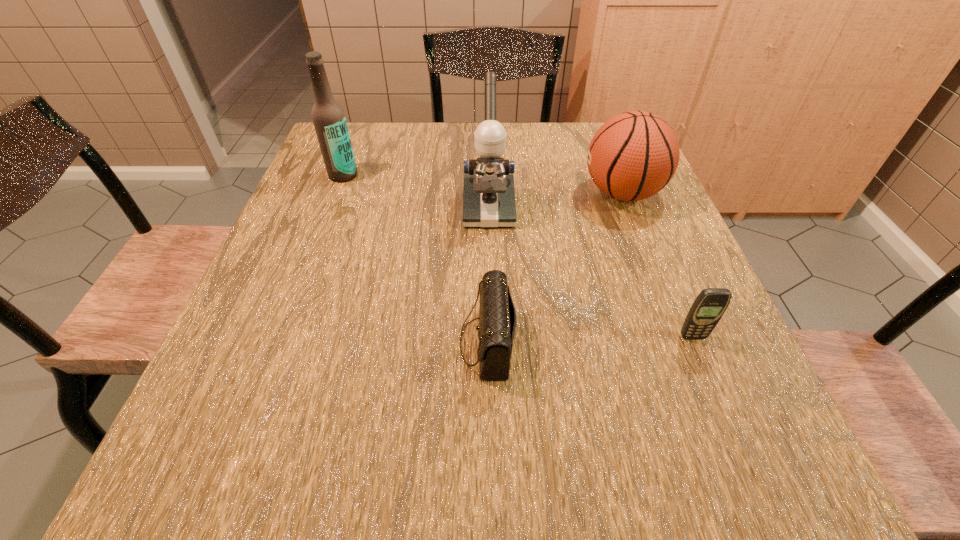
Locate an element on the screen. The width and height of the screenshot is (960, 540). vacant space positioned 0.060m on the screen of the cellular telephone is located at coordinates (706, 370).

Where is `vacant space positioned 0.160m on the front flap of the shortest object`? Image resolution: width=960 pixels, height=540 pixels. vacant space positioned 0.160m on the front flap of the shortest object is located at coordinates (368, 342).

Where is `vacant point located on the front flap of the shortest object`? The height and width of the screenshot is (540, 960). vacant point located on the front flap of the shortest object is located at coordinates (275, 342).

The image size is (960, 540). I want to click on blank space located on the front flap of the shortest object, so click(385, 342).

This screenshot has width=960, height=540. Find the location of `object present at the far edge`. object present at the far edge is located at coordinates (329, 120).

The width and height of the screenshot is (960, 540). I want to click on object that is positioned at the left edge, so click(329, 120).

The height and width of the screenshot is (540, 960). What are the coordinates of `basketball that is at the right edge` in the screenshot? It's located at tap(634, 155).

This screenshot has width=960, height=540. What are the coordinates of `cellular telephone that is at the right edge` in the screenshot? It's located at (709, 306).

Where is `object that is positioned at the far left corner`? The height and width of the screenshot is (540, 960). object that is positioned at the far left corner is located at coordinates (329, 120).

In order to click on vacant space at the far edge in this screenshot , I will do `click(468, 132)`.